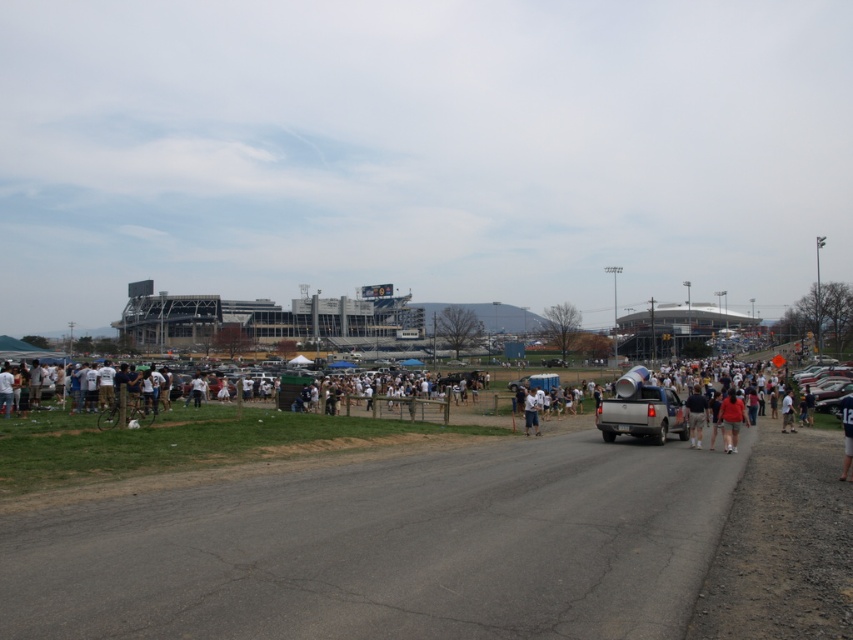
You are standing at the edge of the road near the silver pickup truck and want to hand a flyer to both the person wearing the matte red shirt at center and the person wearing the tan fabric shirt at center. Which person is closer to you?

The matte red shirt at center is 15.62 feet away from the tan fabric shirt at center, so the tan fabric shirt at center is closer to you since it is only 15.62 feet away from the matte red shirt at center and you are near the silver pickup truck.

Consider the image. You are a photographer at the event and want to capture both the matte red shirt at center and the tan fabric shirt at center in a single shot. Which shirt should you position closer to the left side of your camera frame to include both?

You should position the matte red shirt at center closer to the left side of your camera frame since it is already to the left of the tan fabric shirt at center in the scene.

You are a photographer standing at the point with coordinates point (730, 419). You want to take a picture of the silver pickup truck parked on the right side of the road. Is the matte red shirt at center in your way?

The point (730, 419) indicates the matte red shirt at center, so the matte red shirt at center is where you are standing. Therefore, you cannot take a photo of the silver pickup truck parked on the right side of the road because the matte red shirt at center is blocking your view.